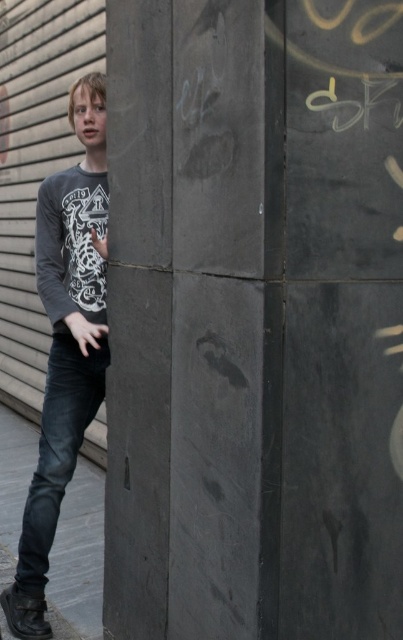
Question: Among these objects, which one is nearest to the camera?

Choices:
 (A) dark gray cotton shirt at left
 (B) black denim jeans at lower left

Answer: (A)

Question: Which of the following is the farthest from the observer?

Choices:
 (A) (72, 211)
 (B) (89, 385)

Answer: (B)

Question: Considering the relative positions of dark gray cotton shirt at left and black denim jeans at lower left in the image provided, where is dark gray cotton shirt at left located with respect to black denim jeans at lower left?

Choices:
 (A) above
 (B) below

Answer: (A)

Question: Is dark gray cotton shirt at left further to the viewer compared to black denim jeans at lower left?

Choices:
 (A) yes
 (B) no

Answer: (B)

Question: Which point appears closest to the camera in this image?

Choices:
 (A) 47,404
 (B) 43,216

Answer: (B)

Question: Is dark gray cotton shirt at left in front of black denim jeans at lower left?

Choices:
 (A) no
 (B) yes

Answer: (B)